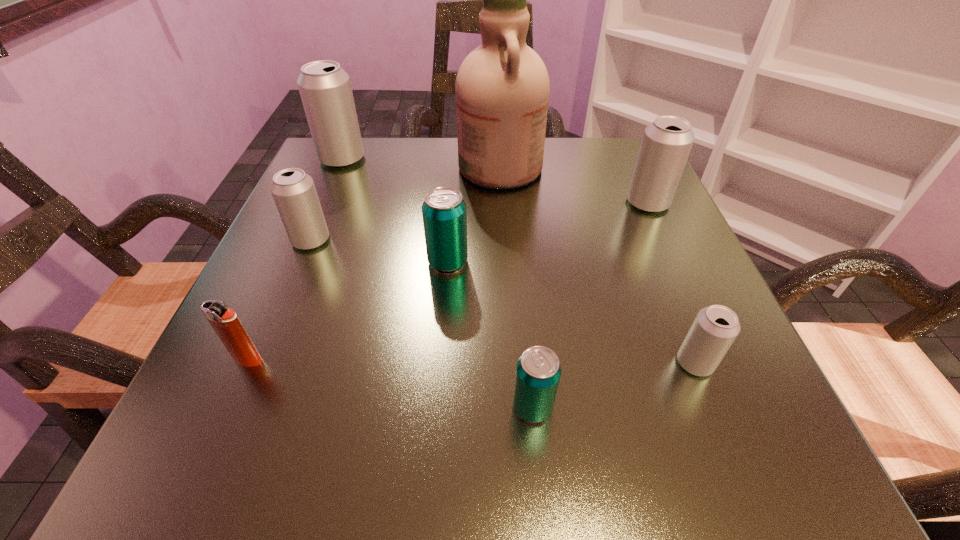
This screenshot has width=960, height=540. Identify the location of free space at the left edge of the desktop. (340, 319).

This screenshot has height=540, width=960. What are the coordinates of `vacant space at the right edge of the desktop` in the screenshot? It's located at (650, 361).

You are a GUI agent. You are given a task and a screenshot of the screen. Output one action in this format:
    pyautogui.click(x=<x>, y=<y>)
    Task: Click on the blank area at the near left corner
    The width and height of the screenshot is (960, 540).
    Given the screenshot: What is the action you would take?
    pyautogui.click(x=298, y=441)

The height and width of the screenshot is (540, 960). In the image, there is a desktop. In order to click on free space at the far right corner in this screenshot , I will do `click(595, 161)`.

Locate an element on the screen. free point between the third biggest white beer can and the right teal beer can is located at coordinates (421, 323).

The height and width of the screenshot is (540, 960). I want to click on free spot between the nearest white beer can and the third nearest white beer can, so click(x=671, y=282).

This screenshot has height=540, width=960. In order to click on vacant space that's between the fifth farthest beer can and the bigger teal beer can in this screenshot , I will do `click(571, 312)`.

Image resolution: width=960 pixels, height=540 pixels. Find the location of `empty space that is in between the left teal beer can and the third biggest white beer can`. empty space that is in between the left teal beer can and the third biggest white beer can is located at coordinates (379, 251).

Identify the location of unoccupied area between the farthest white beer can and the second nearest white beer can. This screenshot has width=960, height=540. (326, 199).

You are a GUI agent. You are given a task and a screenshot of the screen. Output one action in this format:
    pyautogui.click(x=<x>, y=<y>)
    Task: Click on the vacant area that lies between the seventh shortest object and the igniter
    
    Given the screenshot: What is the action you would take?
    pyautogui.click(x=296, y=259)